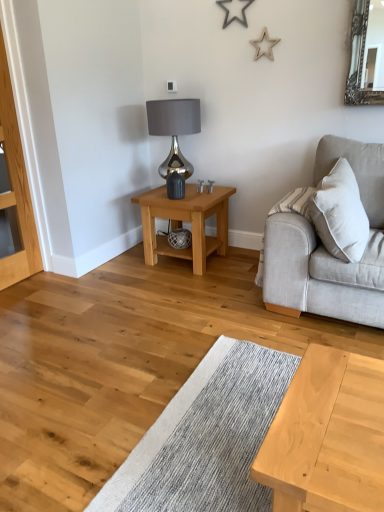
Identify the location of blank space to the left of light gray fabric couch at right. (230, 307).